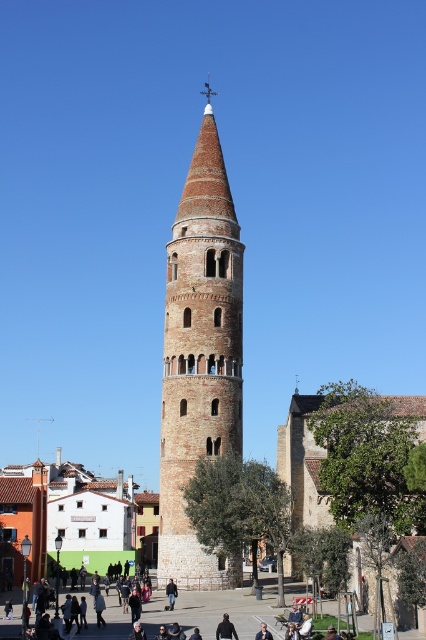
Can you confirm if black fabric person at center is positioned to the left of black leather jacket at center?

No, black fabric person at center is not to the left of black leather jacket at center.

Which is in front, point (233, 627) or point (170, 589)?

Point (233, 627) is more forward.

Locate an element on the screen. black fabric person at center is located at coordinates (226, 628).

Is brick stonework bell tower at center smaller than dark brown leather jacket at center?

Incorrect, brick stonework bell tower at center is not smaller in size than dark brown leather jacket at center.

Based on the photo, does brick stonework bell tower at center have a greater width compared to dark brown leather jacket at center?

→ Incorrect, brick stonework bell tower at center's width does not surpass dark brown leather jacket at center's.

Image resolution: width=426 pixels, height=640 pixels. What do you see at coordinates (199, 358) in the screenshot? I see `brick stonework bell tower at center` at bounding box center [199, 358].

Identify the location of brick stonework bell tower at center. The image size is (426, 640). (199, 358).

Can you confirm if brick stonework bell tower at center is smaller than black fabric person at center?

Actually, brick stonework bell tower at center might be larger than black fabric person at center.

Between point (207, 577) and point (227, 621), which one is positioned behind?

Positioned behind is point (207, 577).

Is point (204, 230) positioned after point (229, 632)?

Yes, it is behind point (229, 632).

Locate an element on the screen. brick stonework bell tower at center is located at coordinates (199, 358).